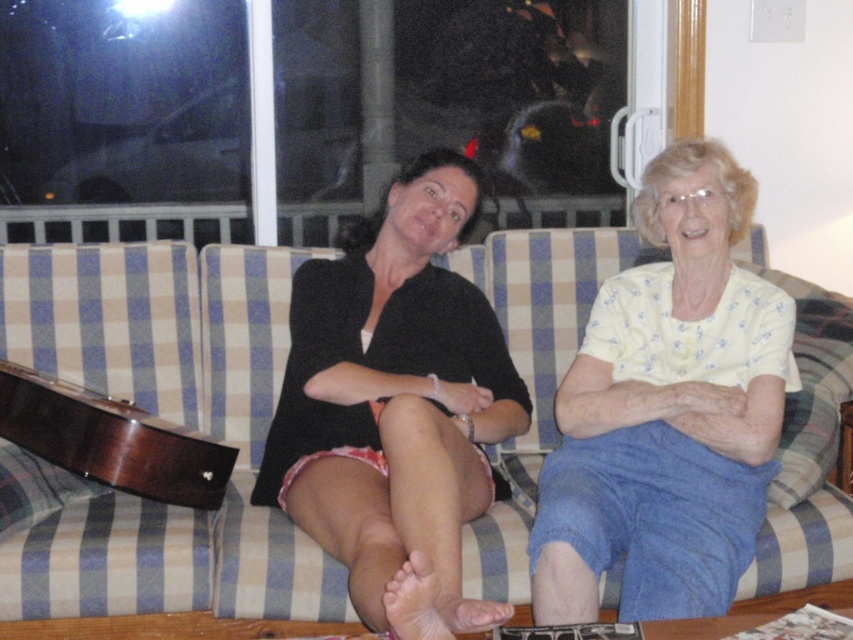
You are a photographer setting up a shoot in this living room. You need to position a small lamp between the light yellow printed blouse at center and the dark wood guitar at lower left. Based on their positions, which side of the guitar should the lamp be placed to ensure it is between them?

The light yellow printed blouse at center is to the right of the dark wood guitar at lower left, so the lamp should be placed to the right side of the dark wood guitar at lower left to be between them.

You are a photographer trying to capture a closeup of the light yellow printed blouse at center while avoiding the other person in the frame. Given that your camera can only focus on objects within a 0.5 unit radius from the point specified, will the point at (666, 412) allow you to capture the blouse without including the other person?

The point at (666, 412) is on the light yellow printed blouse at center, so focusing there would capture the blouse. However, since the other person is positioned on the right side of the frame, and the focus radius is 0.5 units, it is possible that parts of the other person might still be within the focus area depending on their exact position relative to the point. The answer requires more specific spatial data about their distance from the point.